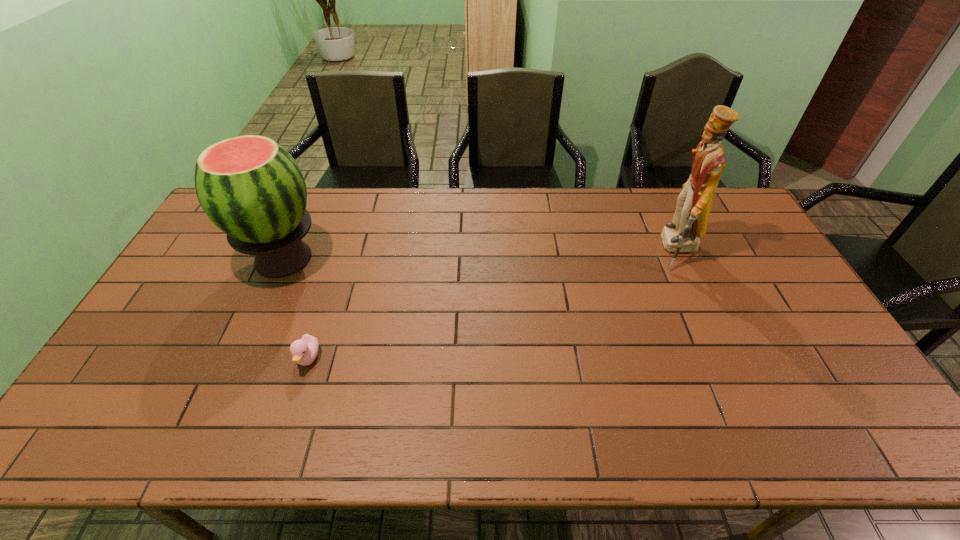
I want to click on nutcracker, so click(x=689, y=223).

Locate an element on the screen. The image size is (960, 540). the rightmost object is located at coordinates (689, 223).

Find the location of a particular element. watermelon is located at coordinates (250, 187).

Locate an element on the screen. The image size is (960, 540). the second tallest object is located at coordinates (250, 187).

This screenshot has height=540, width=960. I want to click on duckling, so click(304, 351).

In order to click on the shortest object in this screenshot , I will do `click(304, 351)`.

Where is `free space located 0.060m on the front-facing side of the nutcracker`? free space located 0.060m on the front-facing side of the nutcracker is located at coordinates (639, 249).

Where is `free space located 0.310m on the front-facing side of the nutcracker`? This screenshot has width=960, height=540. free space located 0.310m on the front-facing side of the nutcracker is located at coordinates (564, 249).

At what (x,y) coordinates should I click in order to perform the action: click on vacant area situated 0.250m on the front-facing side of the nutcracker. Please return your answer as a coordinate pair (x, y). The height and width of the screenshot is (540, 960). Looking at the image, I should click on [x=582, y=249].

Locate an element on the screen. The height and width of the screenshot is (540, 960). free space located 0.310m on the front of the watermelon is located at coordinates (228, 382).